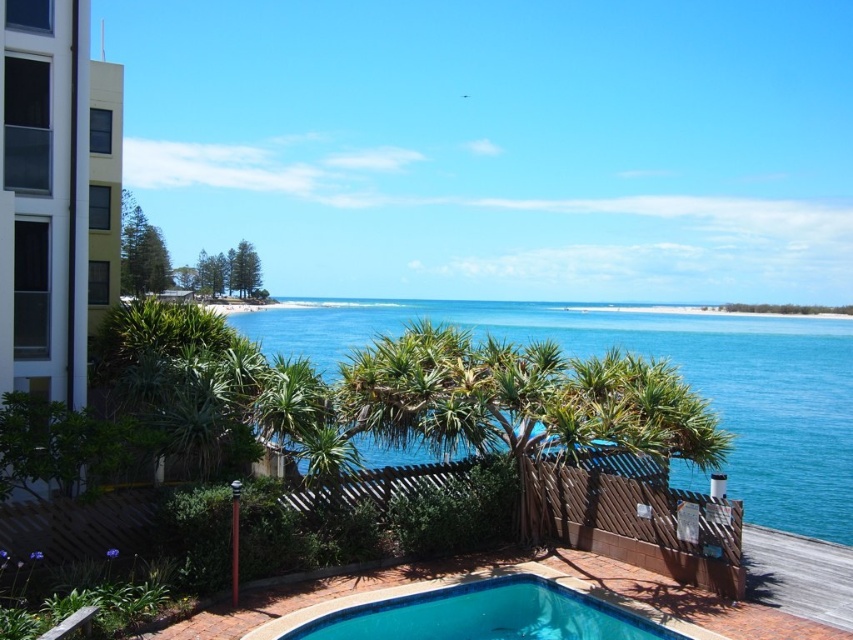
Question: Which object is positioned farthest from the white glass building at left?

Choices:
 (A) blue tile swimming pool at lower center
 (B) blue water at center

Answer: (B)

Question: Estimate the real-world distances between objects in this image. Which object is farther from the white glass building at left?

Choices:
 (A) blue tile swimming pool at lower center
 (B) blue water at center

Answer: (B)

Question: Is blue water at center to the right of white glass building at left from the viewer's perspective?

Choices:
 (A) no
 (B) yes

Answer: (B)

Question: Which of the following is the closest to the observer?

Choices:
 (A) (360, 634)
 (B) (750, 385)

Answer: (A)

Question: Can you confirm if blue water at center is positioned to the left of white glass building at left?

Choices:
 (A) no
 (B) yes

Answer: (A)

Question: From the image, what is the correct spatial relationship of blue water at center in relation to white glass building at left?

Choices:
 (A) left
 (B) right

Answer: (B)